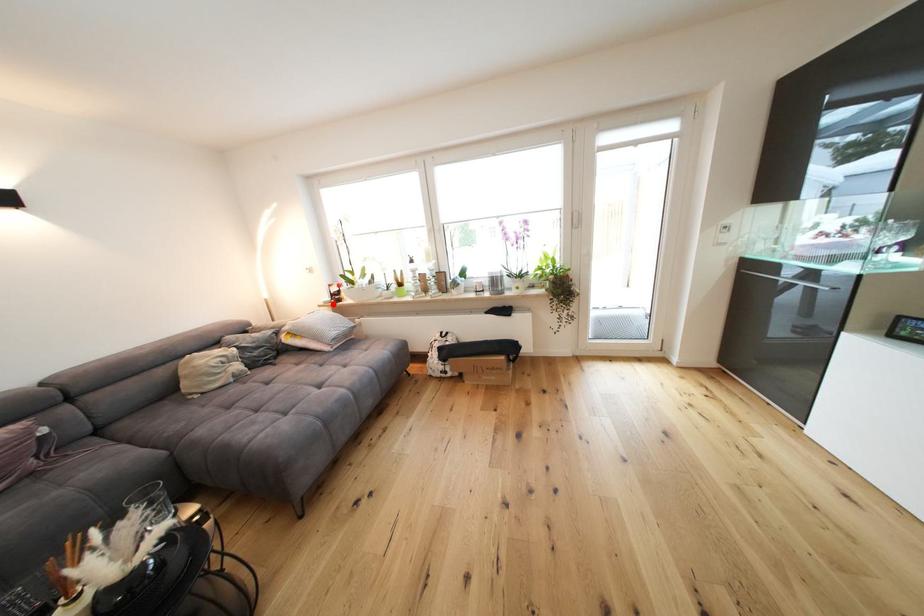
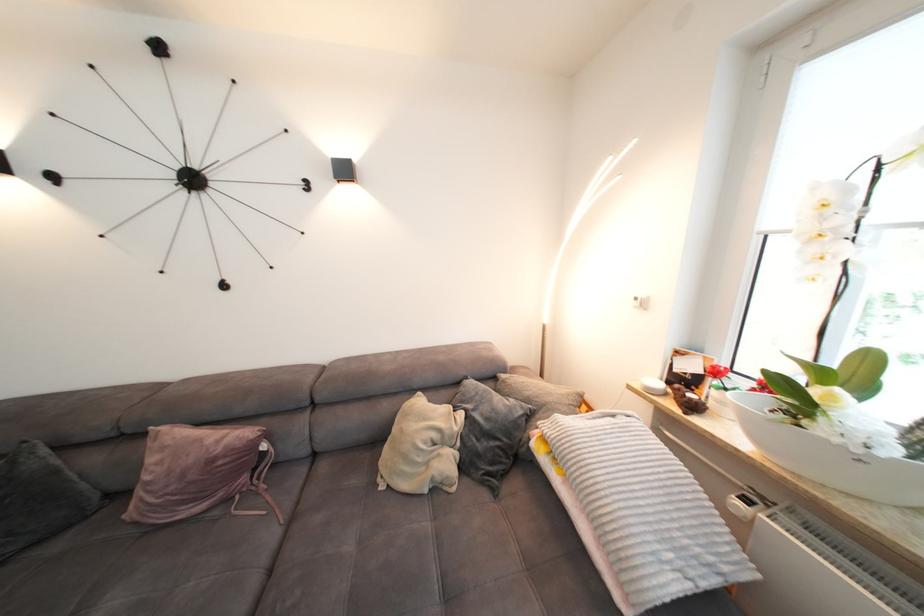
The point at the highlighted location is marked in the first image. Where is the corresponding point in the second image?

(657, 391)